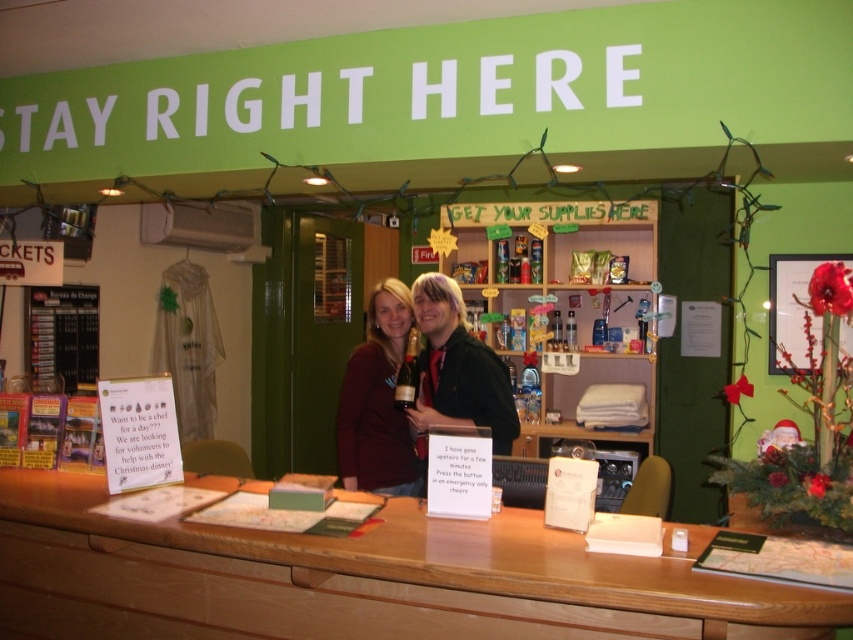
You are at the reception desk and need to locate the emergency exit. The emergency exit sign is placed at point (456, 369). According to the scene description, where exactly is the emergency exit sign located?

The emergency exit sign is located on the matte black bottle at center.

You are at the reception desk and need to place a small note on top of one of the items. Which item, the matte black bottle at center or the matte black sweater at center, would allow the note to be more visible to someone approaching the desk?

The matte black bottle at center has a greater height compared to the matte black sweater at center, so placing the note on top of the matte black bottle at center would make it more visible to someone approaching the desk.